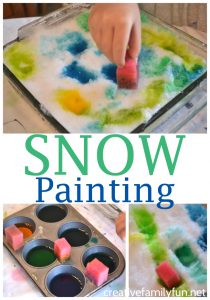
Where is `silver tray`? The height and width of the screenshot is (300, 210). silver tray is located at coordinates (77, 249).